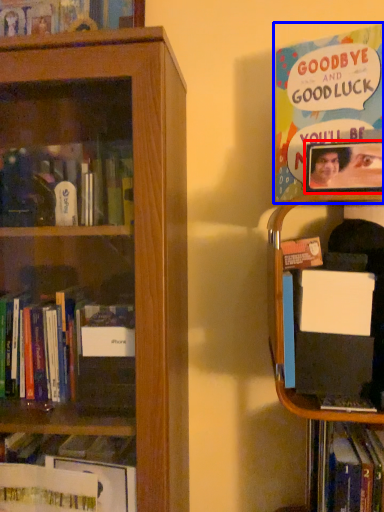
Question: Which object is further to the camera taking this photo, picture frame (highlighted by a red box) or book (highlighted by a blue box)?

Choices:
 (A) picture frame
 (B) book

Answer: (B)